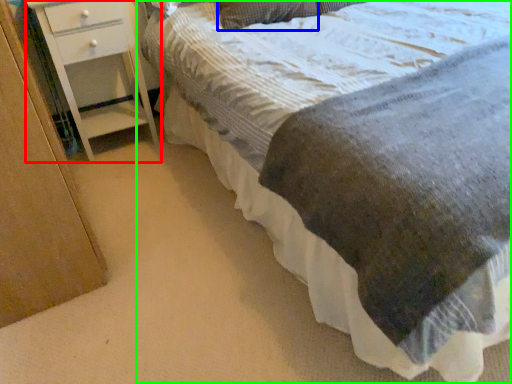
Question: Which is farther away from chest of drawers (highlighted by a red box)? pillow (highlighted by a blue box) or bed (highlighted by a green box)?

Choices:
 (A) pillow
 (B) bed

Answer: (B)